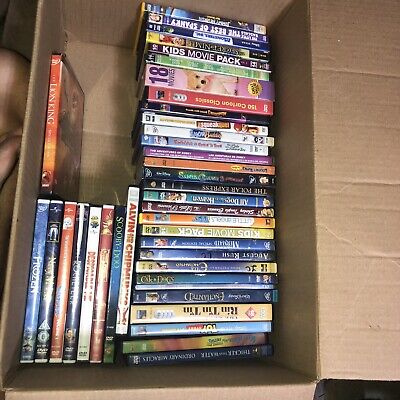
I want to click on vertical dvd's, so click(x=126, y=283), click(x=116, y=284), click(x=102, y=284), click(x=91, y=285), click(x=76, y=286), click(x=63, y=290), click(x=52, y=290), click(x=32, y=292), click(x=48, y=182).